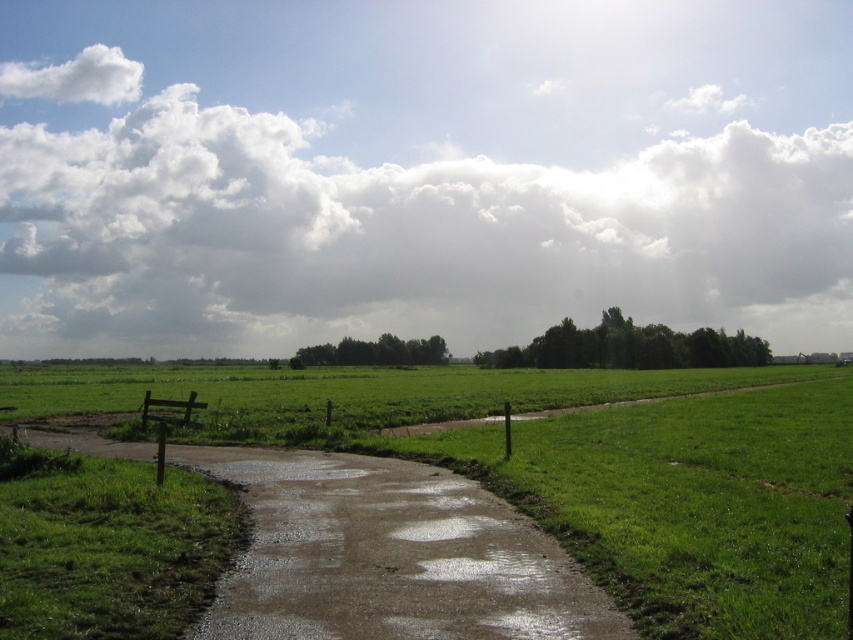
Does muddy concrete path at center have a greater height compared to green grassy path at center?

Incorrect, muddy concrete path at center's height is not larger of green grassy path at center's.

Who is shorter, muddy concrete path at center or green grassy path at center?

muddy concrete path at center

Is point (421, 570) in front of point (776, 385)?

Yes, point (421, 570) is in front of point (776, 385).

Identify the location of muddy concrete path at center. The image size is (853, 640). (387, 556).

Consider the image. Can you confirm if white fluffy cloud at upper center is positioned above green grassy path at center?

Indeed, white fluffy cloud at upper center is positioned over green grassy path at center.

Based on the photo, can you confirm if white fluffy cloud at upper center is positioned to the left of green grassy path at center?

Yes, white fluffy cloud at upper center is to the left of green grassy path at center.

Locate an element on the screen. white fluffy cloud at upper center is located at coordinates (395, 227).

Can you confirm if white fluffy cloud at upper center is positioned to the left of muddy concrete path at center?

Correct, you'll find white fluffy cloud at upper center to the left of muddy concrete path at center.

Does point (846, 332) come behind point (384, 518)?

Yes, point (846, 332) is behind point (384, 518).

This screenshot has height=640, width=853. In order to click on white fluffy cloud at upper center in this screenshot , I will do `click(395, 227)`.